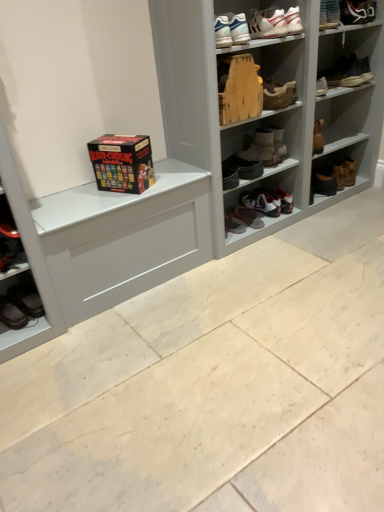
Question: From the image's perspective, is white leather sneaker at upper right, acting as the 11th footwear starting from the left, beneath wooden shoe at upper center, positioned as the 8th footwear in left-to-right order?

Choices:
 (A) no
 (B) yes

Answer: (A)

Question: Are white leather sneaker at upper right, the third footwear when ordered from right to left, and wooden shoe at upper center, acting as the 6th footwear starting from the right, making contact?

Choices:
 (A) no
 (B) yes

Answer: (A)

Question: Is white leather sneaker at upper right, the third footwear when ordered from right to left, closer to camera compared to wooden shoe at upper center, positioned as the 8th footwear in left-to-right order?

Choices:
 (A) yes
 (B) no

Answer: (B)

Question: Can you confirm if white leather sneaker at upper right, the third footwear when ordered from right to left, is positioned to the right of wooden shoe at upper center, acting as the 6th footwear starting from the right?

Choices:
 (A) yes
 (B) no

Answer: (A)

Question: Does white leather sneaker at upper right, acting as the 11th footwear starting from the left, turn towards wooden shoe at upper center, acting as the 6th footwear starting from the right?

Choices:
 (A) no
 (B) yes

Answer: (A)

Question: In the image, is white painted wood shelf at upper center positioned in front of or behind white leather sneaker at upper right, acting as the 11th footwear starting from the left?

Choices:
 (A) front
 (B) behind

Answer: (A)

Question: Is white painted wood shelf at upper center bigger or smaller than white leather sneaker at upper right, the third footwear when ordered from right to left?

Choices:
 (A) big
 (B) small

Answer: (A)

Question: From a real-world perspective, is white painted wood shelf at upper center physically located above or below white leather sneaker at upper right, acting as the 11th footwear starting from the left?

Choices:
 (A) below
 (B) above

Answer: (A)

Question: Which is correct: white painted wood shelf at upper center is inside white leather sneaker at upper right, acting as the 11th footwear starting from the left, or outside of it?

Choices:
 (A) outside
 (B) inside

Answer: (A)

Question: Is wooden shoe at upper center, positioned as the 8th footwear in left-to-right order, bigger or smaller than black leather shoes at lower left, which ranks as the 13th footwear in right-to-left order?

Choices:
 (A) big
 (B) small

Answer: (A)

Question: From the image's perspective, is wooden shoe at upper center, acting as the 6th footwear starting from the right, located above or below black leather shoes at lower left, which ranks as the 13th footwear in right-to-left order?

Choices:
 (A) below
 (B) above

Answer: (B)

Question: Is wooden shoe at upper center, acting as the 6th footwear starting from the right, in front of or behind black leather shoes at lower left, which ranks as the 13th footwear in right-to-left order, in the image?

Choices:
 (A) front
 (B) behind

Answer: (B)

Question: From a real-world perspective, is wooden shoe at upper center, acting as the 6th footwear starting from the right, positioned above or below black leather shoes at lower left, which appears as the first footwear when viewed from the left?

Choices:
 (A) above
 (B) below

Answer: (A)

Question: Is point (273, 88) closer or farther from the camera than point (220, 2)?

Choices:
 (A) farther
 (B) closer

Answer: (A)

Question: Is wooden shoe at upper center, acting as the 6th footwear starting from the right, inside the boundaries of white painted wood shelf at upper center, or outside?

Choices:
 (A) outside
 (B) inside

Answer: (B)